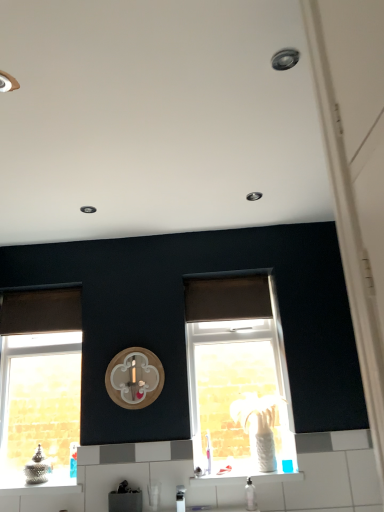
Question: Considering the relative positions of clear glass window at left, the 2th window when ordered from right to left, and satin silver faucet at lower center in the image provided, is clear glass window at left, the 2th window when ordered from right to left, to the left of satin silver faucet at lower center from the viewer's perspective?

Choices:
 (A) no
 (B) yes

Answer: (B)

Question: Does clear glass window at left, the first window from the left, lie behind satin silver faucet at lower center?

Choices:
 (A) no
 (B) yes

Answer: (B)

Question: From a real-world perspective, is clear glass window at left, the 2th window when ordered from right to left, on satin silver faucet at lower center?

Choices:
 (A) yes
 (B) no

Answer: (A)

Question: Is clear glass window at left, the first window from the left, facing away from satin silver faucet at lower center?

Choices:
 (A) yes
 (B) no

Answer: (B)

Question: Is clear glass window at left, the first window from the left, thinner than satin silver faucet at lower center?

Choices:
 (A) no
 (B) yes

Answer: (B)

Question: From the image's perspective, is white glossy tile at lower center located above or below translucent glass window at center, acting as the 1th window starting from the right?

Choices:
 (A) below
 (B) above

Answer: (A)

Question: Considering the positions of white glossy tile at lower center and translucent glass window at center, the 2th window viewed from the left, in the image, is white glossy tile at lower center taller or shorter than translucent glass window at center, the 2th window viewed from the left,?

Choices:
 (A) tall
 (B) short

Answer: (B)

Question: From a real-world perspective, is white glossy tile at lower center positioned above or below translucent glass window at center, acting as the 1th window starting from the right?

Choices:
 (A) below
 (B) above

Answer: (A)

Question: Is white glossy tile at lower center bigger or smaller than translucent glass window at center, acting as the 1th window starting from the right?

Choices:
 (A) big
 (B) small

Answer: (B)

Question: In the image, is brown fabric curtain at left, the second curtain from the right, positioned in front of or behind brown matte curtain at center, the first curtain positioned from the right?

Choices:
 (A) behind
 (B) front

Answer: (A)

Question: Considering the relative positions of brown fabric curtain at left, the first curtain viewed from the left, and brown matte curtain at center, the first curtain positioned from the right, in the image provided, is brown fabric curtain at left, the first curtain viewed from the left, to the left or to the right of brown matte curtain at center, the first curtain positioned from the right,?

Choices:
 (A) left
 (B) right

Answer: (A)

Question: From a real-world perspective, is brown fabric curtain at left, the second curtain from the right, physically located above or below brown matte curtain at center, the 2th curtain from the left?

Choices:
 (A) above
 (B) below

Answer: (A)

Question: Looking at the image, does brown fabric curtain at left, the first curtain viewed from the left, seem bigger or smaller compared to brown matte curtain at center, the 2th curtain from the left?

Choices:
 (A) big
 (B) small

Answer: (B)

Question: In the image, is brown fabric curtain at left, the second curtain from the right, on the left side or the right side of white glossy tile at lower center?

Choices:
 (A) right
 (B) left

Answer: (B)

Question: Is brown fabric curtain at left, the second curtain from the right, in front of or behind white glossy tile at lower center in the image?

Choices:
 (A) front
 (B) behind

Answer: (B)